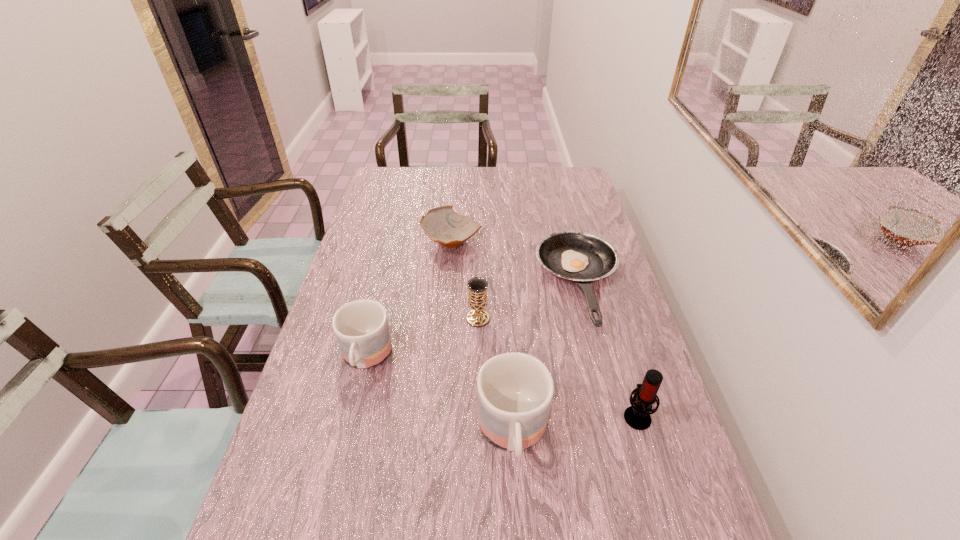
The height and width of the screenshot is (540, 960). What are the coordinates of `free point located 0.270m on the front of the pottery` in the screenshot? It's located at (445, 320).

In order to click on vacant space located 0.380m on the front of the frying pan in this screenshot , I will do coord(629,472).

You are a GUI agent. You are given a task and a screenshot of the screen. Output one action in this format:
    pyautogui.click(x=<x>, y=<y>)
    Task: Click on the blank space located on the back of the microphone
    Image resolution: width=960 pixels, height=540 pixels.
    Given the screenshot: What is the action you would take?
    pyautogui.click(x=609, y=321)

You are a GUI agent. You are given a task and a screenshot of the screen. Output one action in this format:
    pyautogui.click(x=<x>, y=<y>)
    Task: Click on the free location located on the back of the chalice
    The height and width of the screenshot is (540, 960).
    Given the screenshot: What is the action you would take?
    pyautogui.click(x=478, y=260)

Where is `object located in the left edge section of the desktop`? The image size is (960, 540). object located in the left edge section of the desktop is located at coordinates (361, 327).

Find the location of a particular element. This screenshot has width=960, height=540. frying pan that is positioned at the right edge is located at coordinates tap(580, 257).

You are a GUI agent. You are given a task and a screenshot of the screen. Output one action in this format:
    pyautogui.click(x=<x>, y=<y>)
    Task: Click on the microphone located at the right edge
    The image size is (960, 540).
    Given the screenshot: What is the action you would take?
    click(637, 416)

The image size is (960, 540). I want to click on vacant region at the far edge of the desktop, so click(x=420, y=194).

In the image, there is a desktop. Where is `free region at the left edge`? Image resolution: width=960 pixels, height=540 pixels. free region at the left edge is located at coordinates (326, 356).

The image size is (960, 540). What are the coordinates of `vacant point at the right edge` in the screenshot? It's located at (595, 379).